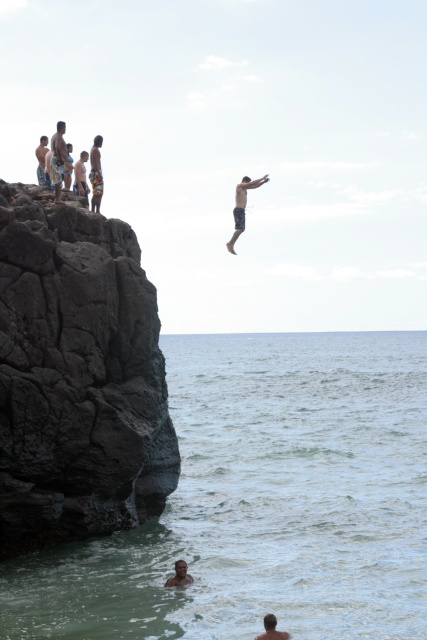
Is beige textured shorts at left thinner than light brown skin at lower center?

No, beige textured shorts at left is not thinner than light brown skin at lower center.

Who is more forward, (61, 132) or (277, 637)?

Positioned in front is point (277, 637).

Who is more forward, (55, 168) or (265, 620)?

Positioned in front is point (265, 620).

Locate an element on the screen. beige textured shorts at left is located at coordinates (58, 160).

In the scene shown: Which is more to the right, tan skin human at upper left or smooth skin man at lower center?

smooth skin man at lower center is more to the right.

Which is below, tan skin human at upper left or smooth skin man at lower center?

smooth skin man at lower center is lower down.

In order to click on tan skin human at upper left in this screenshot , I will do `click(96, 173)`.

Is point (31, 232) closer to viewer compared to point (96, 170)?

That is True.

The image size is (427, 640). I want to click on dark gray rock at left, so click(x=76, y=376).